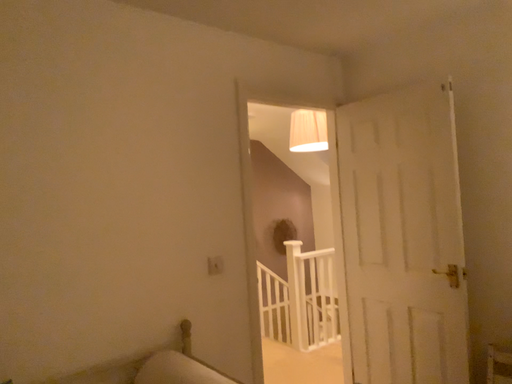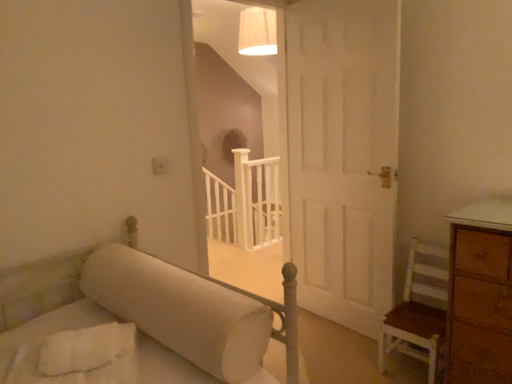
Question: How did the camera likely rotate when shooting the video?

Choices:
 (A) rotated upward
 (B) rotated downward

Answer: (B)